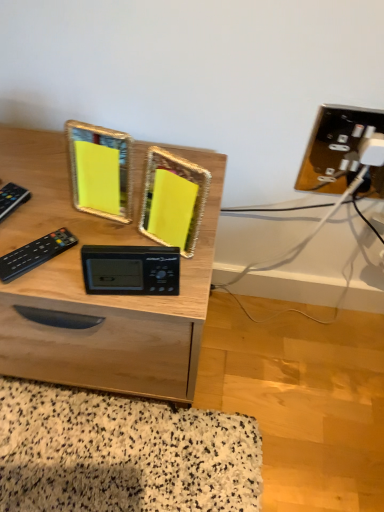
The height and width of the screenshot is (512, 384). Find the location of `vacant location behind black plastic remote at left, the 1th control viewed from the left`. vacant location behind black plastic remote at left, the 1th control viewed from the left is located at coordinates (31, 169).